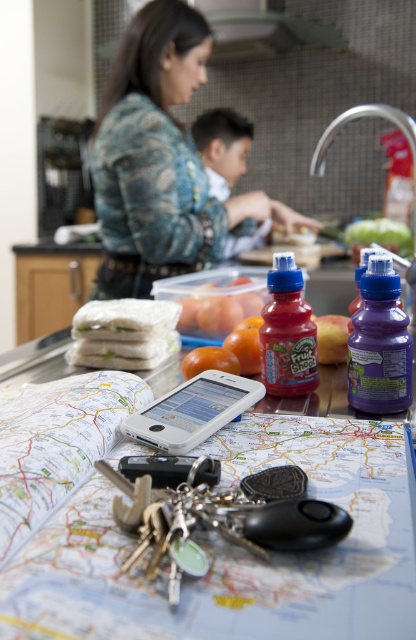
Question: Which object appears closest to the camera in this image?

Choices:
 (A) translucent plastic bottle of fruit juice at center
 (B) green leafy vegetable at upper right
 (C) white glossy map at center
 (D) smooth apple at center

Answer: (C)

Question: Which point appears farthest from the camera in this image?

Choices:
 (A) (210, 433)
 (B) (307, 346)

Answer: (B)

Question: Can you confirm if purple plastic bottle at center is thinner than silver metallic faucet at upper right?

Choices:
 (A) no
 (B) yes

Answer: (B)

Question: Which of the following is the closest to the observer?

Choices:
 (A) smooth tomato at center
 (B) white glossy map at center

Answer: (B)

Question: Can you confirm if white glossy map at center is bigger than smooth tomato at center?

Choices:
 (A) no
 (B) yes

Answer: (B)

Question: Is white glossy map at center above smooth tomato at center?

Choices:
 (A) yes
 (B) no

Answer: (B)